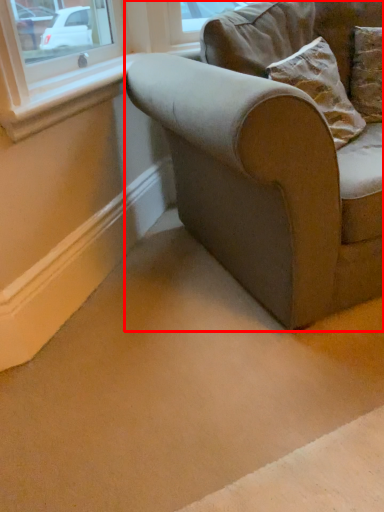
Question: Observing the image, what is the correct spatial positioning of studio couch (annotated by the red box) in reference to window sill?

Choices:
 (A) right
 (B) left

Answer: (A)